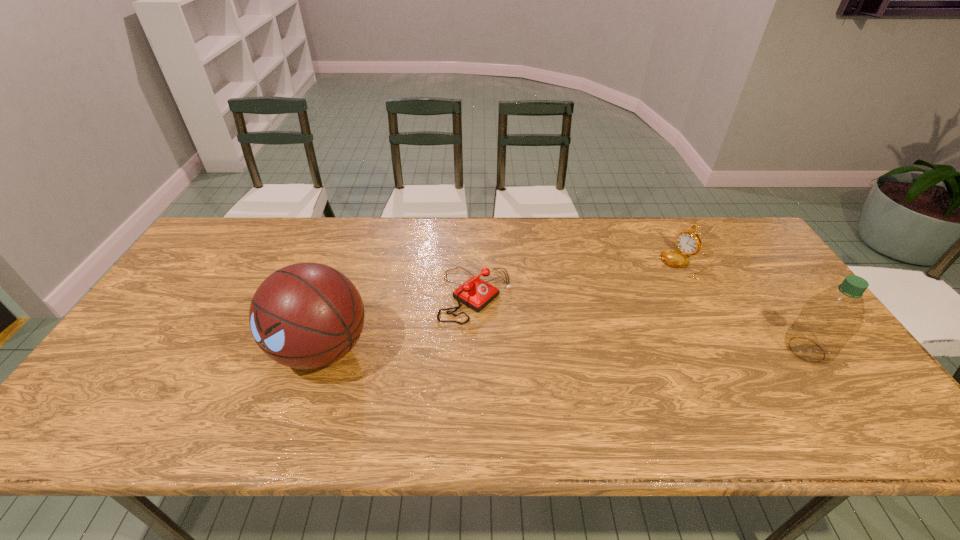
The width and height of the screenshot is (960, 540). Find the location of `free space located 0.090m on the dial of the shortest object`. free space located 0.090m on the dial of the shortest object is located at coordinates click(x=531, y=330).

The image size is (960, 540). Find the location of `vacant space located 0.140m on the face of the second object from right to left`. vacant space located 0.140m on the face of the second object from right to left is located at coordinates (640, 291).

At what (x,y) coordinates should I click in order to perform the action: click on free location located 0.290m on the face of the second object from right to left. Please return your answer as a coordinate pair (x, y). This screenshot has width=960, height=540. Looking at the image, I should click on (605, 312).

Locate an element on the screen. free spot located 0.330m on the face of the second object from right to left is located at coordinates (594, 318).

This screenshot has height=540, width=960. I want to click on object present at the far edge, so click(x=688, y=242).

Where is `object that is positioned at the near edge`? The image size is (960, 540). object that is positioned at the near edge is located at coordinates (306, 316).

The height and width of the screenshot is (540, 960). I want to click on object that is positioned at the right edge, so click(828, 320).

The image size is (960, 540). What are the coordinates of `blank area at the far edge` in the screenshot? It's located at (683, 221).

Find the location of a particular element. The image size is (960, 540). free space at the near edge of the desktop is located at coordinates (196, 394).

In the image, there is a desktop. Identify the location of vacant region at the left edge. (139, 336).